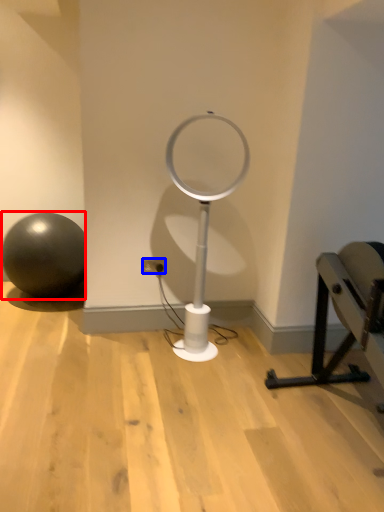
Question: Which of the following is the closest to the observer, ball (highlighted by a red box) or electric outlet (highlighted by a blue box)?

Choices:
 (A) ball
 (B) electric outlet

Answer: (B)